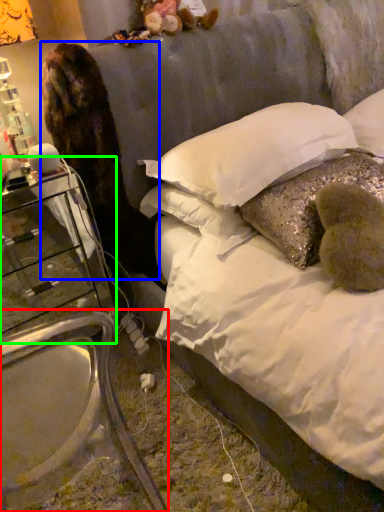
Question: Estimate the real-world distances between objects in this image. Which object is farther from armchair (highlighted by a red box), animal (highlighted by a blue box) or nightstand (highlighted by a green box)?

Choices:
 (A) animal
 (B) nightstand

Answer: (A)